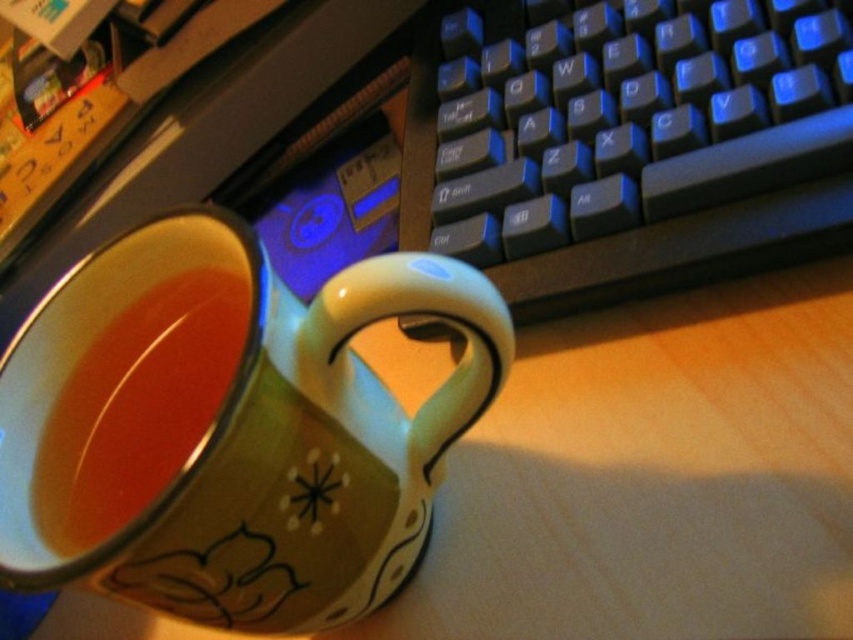
Question: Can you confirm if matte ceramic mug at center is positioned below black plastic keyboard at upper right?

Choices:
 (A) no
 (B) yes

Answer: (B)

Question: Is black plastic keyboard at upper right above translucent glass tea at center?

Choices:
 (A) no
 (B) yes

Answer: (B)

Question: Which is farther from the translucent glass tea at center?

Choices:
 (A) black plastic keyboard at upper right
 (B) matte ceramic mug at center

Answer: (A)

Question: Observing the image, what is the correct spatial positioning of matte ceramic mug at center in reference to translucent glass tea at center?

Choices:
 (A) below
 (B) above

Answer: (A)

Question: Which point appears closest to the camera in this image?

Choices:
 (A) (165, 449)
 (B) (119, 422)
 (C) (770, 54)

Answer: (A)

Question: Which object is the closest to the black plastic keyboard at upper right?

Choices:
 (A) matte ceramic mug at center
 (B) translucent glass tea at center

Answer: (A)